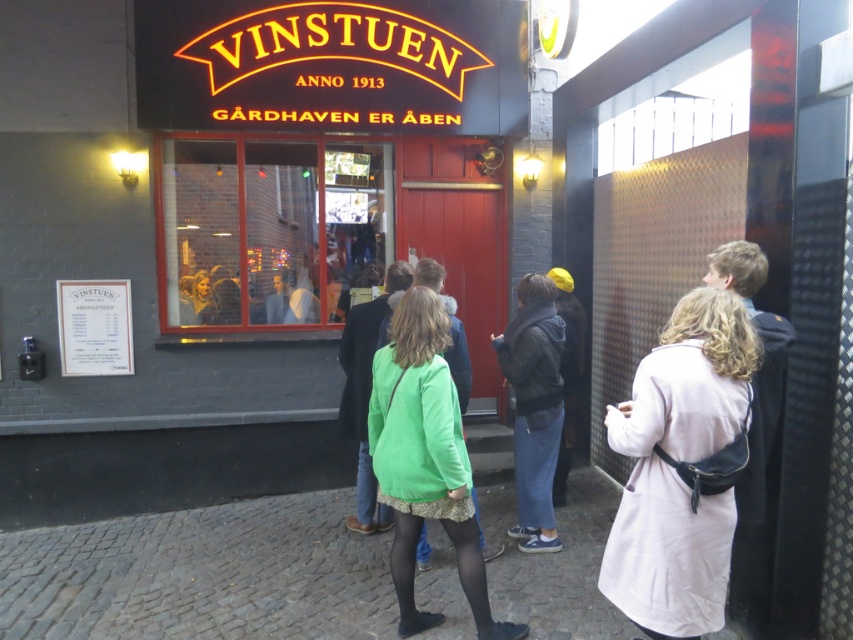
Question: Which point appears closest to the camera in this image?

Choices:
 (A) click(x=529, y=368)
 (B) click(x=364, y=362)
 (C) click(x=770, y=356)
 (D) click(x=376, y=436)

Answer: (C)

Question: Which object appears closest to the camera in this image?

Choices:
 (A) light pink fabric coat at right
 (B) light beige coat at center
 (C) green fabric coat at center

Answer: (B)

Question: Is light beige coat at center below green matte jacket at center?

Choices:
 (A) no
 (B) yes

Answer: (A)

Question: Observing the image, what is the correct spatial positioning of green matte jacket at center in reference to light pink fabric coat at right?

Choices:
 (A) below
 (B) above

Answer: (A)

Question: Among these objects, which one is farthest from the camera?

Choices:
 (A) green fabric coat at center
 (B) green matte jacket at center

Answer: (A)

Question: Does green matte jacket at center appear on the left side of denim jacket at center?

Choices:
 (A) yes
 (B) no

Answer: (A)